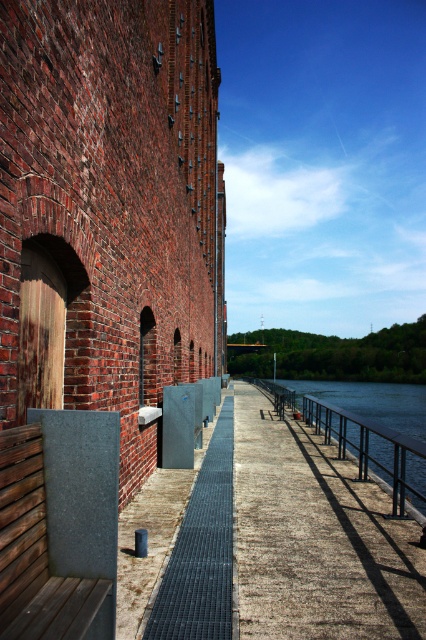
Question: Which object is closer to the camera taking this photo?

Choices:
 (A) metallic grating at center
 (B) dark gray textured bench at lower left

Answer: (B)

Question: Is metallic grating at center in front of dark gray metal grate at center?

Choices:
 (A) no
 (B) yes

Answer: (A)

Question: Among these objects, which one is nearest to the camera?

Choices:
 (A) dark gray metal grate at center
 (B) dark gray textured bench at lower left
 (C) metallic grating at center

Answer: (B)

Question: Is dark gray textured bench at lower left further to the viewer compared to dark gray metal grate at center?

Choices:
 (A) yes
 (B) no

Answer: (B)

Question: Is metallic grating at center wider than dark gray textured bench at lower left?

Choices:
 (A) yes
 (B) no

Answer: (A)

Question: Which object appears closest to the camera in this image?

Choices:
 (A) metallic grating at center
 (B) dark gray textured bench at lower left

Answer: (B)